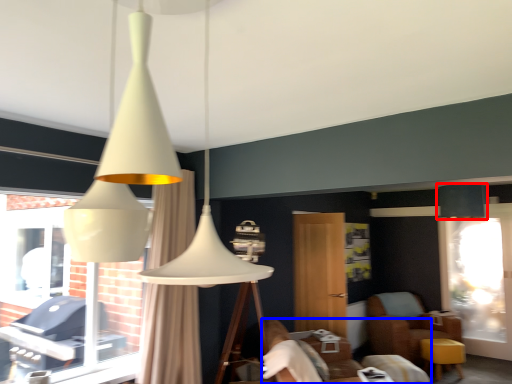
Question: Among these objects, which one is nearest to the camera, lamp (highlighted by a red box) or furniture (highlighted by a blue box)?

Choices:
 (A) lamp
 (B) furniture

Answer: (B)